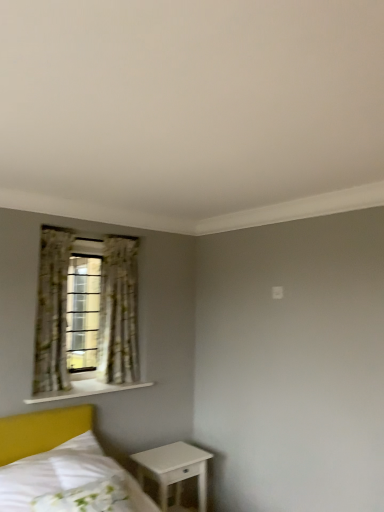
Question: Is white wooden shelf at lower left facing away from floral fabric curtain at left, which is counted as the 2th curtain, starting from the left?

Choices:
 (A) yes
 (B) no

Answer: (B)

Question: Considering the relative sizes of white wooden shelf at lower left and floral fabric curtain at left, which is counted as the 2th curtain, starting from the left, in the image provided, is white wooden shelf at lower left wider than floral fabric curtain at left, which is counted as the 2th curtain, starting from the left,?

Choices:
 (A) yes
 (B) no

Answer: (A)

Question: Is white wooden shelf at lower left outside floral fabric curtain at left, the first curtain viewed from the right?

Choices:
 (A) yes
 (B) no

Answer: (A)

Question: Is white wooden shelf at lower left thinner than floral fabric curtain at left, which is counted as the 2th curtain, starting from the left?

Choices:
 (A) no
 (B) yes

Answer: (A)

Question: Is floral fabric curtain at left, which is counted as the 2th curtain, starting from the left, surrounded by white wooden shelf at lower left?

Choices:
 (A) no
 (B) yes

Answer: (A)

Question: Relative to white wooden shelf at lower left, is floral fabric curtain at left in front or behind?

Choices:
 (A) behind
 (B) front

Answer: (A)

Question: Is point (79, 359) positioned closer to the camera than point (81, 388)?

Choices:
 (A) farther
 (B) closer

Answer: (A)

Question: From their relative heights in the image, would you say floral fabric curtain at left is taller or shorter than white wooden shelf at lower left?

Choices:
 (A) tall
 (B) short

Answer: (A)

Question: From the image's perspective, is floral fabric curtain at left located above or below white wooden shelf at lower left?

Choices:
 (A) above
 (B) below

Answer: (A)

Question: In the image, is white floral fabric pillow at lower left positioned in front of or behind white wooden shelf at lower left?

Choices:
 (A) behind
 (B) front

Answer: (B)

Question: From a real-world perspective, is white floral fabric pillow at lower left positioned above or below white wooden shelf at lower left?

Choices:
 (A) above
 (B) below

Answer: (B)

Question: Does point (54, 495) appear closer or farther from the camera than point (89, 393)?

Choices:
 (A) closer
 (B) farther

Answer: (A)

Question: Is white floral fabric pillow at lower left taller or shorter than white wooden shelf at lower left?

Choices:
 (A) short
 (B) tall

Answer: (B)

Question: In the image, is white glossy nightstand at lower right positioned in front of or behind floral fabric curtain at left, marked as the 1th curtain in a left-to-right arrangement?

Choices:
 (A) behind
 (B) front

Answer: (B)

Question: Looking at their shapes, would you say white glossy nightstand at lower right is wider or thinner than floral fabric curtain at left, the second curtain viewed from the right?

Choices:
 (A) thin
 (B) wide

Answer: (B)